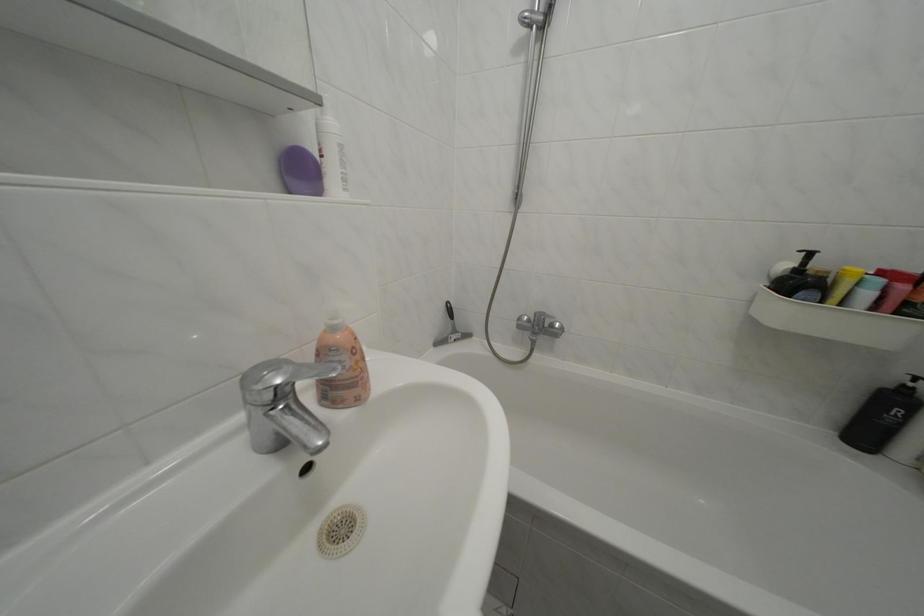
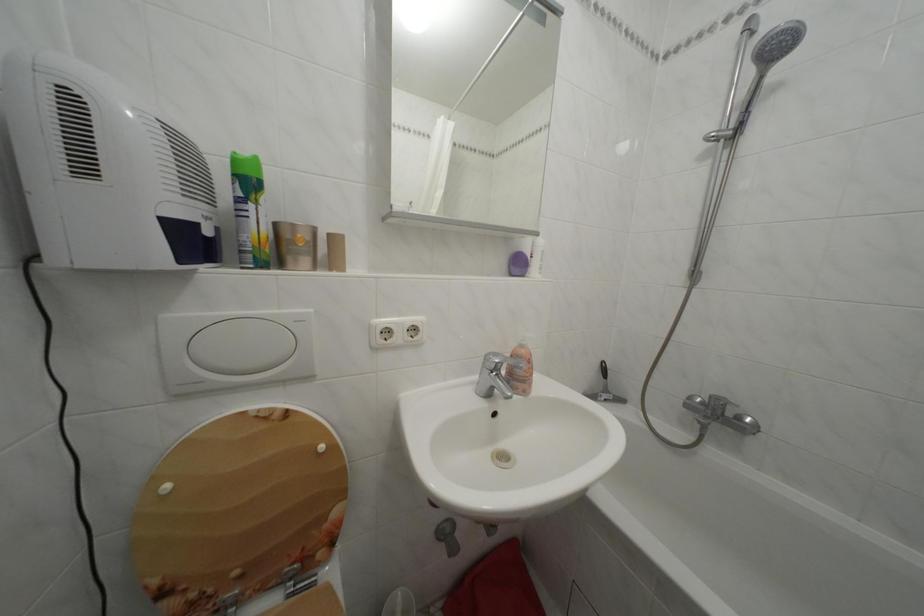
Question: The first image is from the beginning of the video and the second image is from the end. How did the camera likely rotate when shooting the video?

Choices:
 (A) Left
 (B) Right
 (C) Up
 (D) Down

Answer: (A)